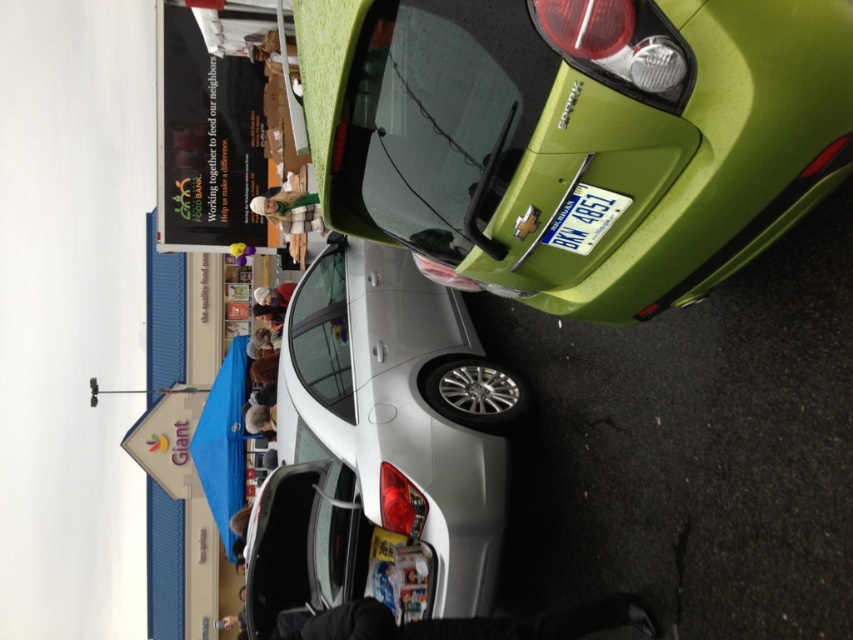
You are standing at the entrance of the Giant parking lot and want to locate the green matte car at upper right. According to the parking lot layout, where should you look relative to the building labeled Giant?

The green matte car at upper right is located at point (576, 134), which is diagonally positioned in the foreground near the building labeled Giant. Since it is at the upper right, you should look towards the upper right area of the parking lot near the building to find it.

In the scene shown: You are a delivery driver who needs to park a large truck in this parking lot. You see the green matte car at upper right and the satin silver sedan at center. Which vehicle is wider, and would it be easier to park the truck next to the wider one?

The green matte car at upper right is wider than the satin silver sedan at center. Since the truck is large, parking next to the wider vehicle might be easier as there could be more space available.

You are a delivery driver who needs to park your vehicle in the parking lot shown. You see the green matte car at upper right and the satin silver sedan at center. Which car is positioned higher up in the image?

The green matte car at upper right is positioned higher up in the image than the satin silver sedan at center.